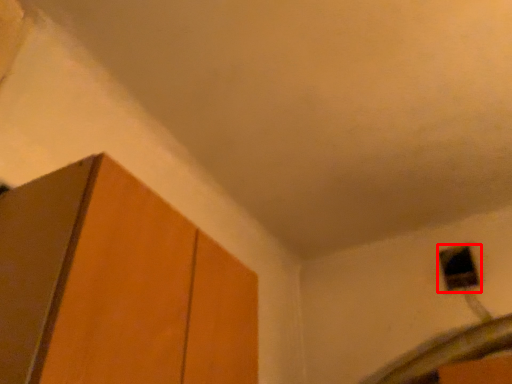
Question: Considering the relative positions of window (annotated by the red box) and cabinetry in the image provided, where is window (annotated by the red box) located with respect to the staircase?

Choices:
 (A) left
 (B) right

Answer: (B)